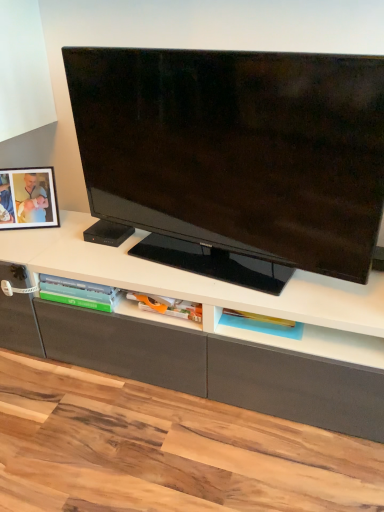
Identify the location of matte black tv at center. (233, 158).

Measure the distance between translucent plastic tray at lower center and camera.

They are 1.21 meters apart.

This screenshot has width=384, height=512. I want to click on matte black picture frame at left, so click(28, 198).

Considering the sizes of matte black picture frame at left and translucent plastic tray at lower center in the image, is matte black picture frame at left wider or thinner than translucent plastic tray at lower center?

matte black picture frame at left is thinner than translucent plastic tray at lower center.

Visually, is matte black picture frame at left positioned to the left or to the right of translucent plastic tray at lower center?

Based on their positions, matte black picture frame at left is located to the left of translucent plastic tray at lower center.

Can you tell me how much matte black picture frame at left and translucent plastic tray at lower center differ in facing direction?

The angle between the facing direction of matte black picture frame at left and the facing direction of translucent plastic tray at lower center is 24.3 degrees.

Does matte black picture frame at left come behind translucent plastic tray at lower center?

Yes.

Which object is positioned more to the right, translucent plastic tray at lower center or matte black tv at center?

Positioned to the right is translucent plastic tray at lower center.

Is translucent plastic tray at lower center taller or shorter than matte black tv at center?

In the image, translucent plastic tray at lower center appears to be shorter than matte black tv at center.

Considering the points (298, 336) and (142, 136), which point is behind, point (298, 336) or point (142, 136)?

Point (142, 136)

Which object is wider, translucent plastic tray at lower center or matte black tv at center?

translucent plastic tray at lower center.

From the image's perspective, which one is positioned higher, matte black tv at center or translucent plastic tray at lower center?

matte black tv at center appears higher in the image.

Is matte black tv at center in front of or behind translucent plastic tray at lower center in the image?

Visually, matte black tv at center is located in front of translucent plastic tray at lower center.

Is matte black tv at center placed right next to translucent plastic tray at lower center?

No, matte black tv at center is not beside translucent plastic tray at lower center.

Which is behind, point (142, 140) or point (250, 320)?

Positioned behind is point (250, 320).

Is matte black picture frame at left at the right side of matte black tv at center?

No.

How distant is matte black picture frame at left from matte black tv at center?

matte black picture frame at left and matte black tv at center are 56.54 centimeters apart from each other.

Is matte black tv at center completely or partially inside matte black picture frame at left?

Definitely not — matte black tv at center is not inside matte black picture frame at left.

From a real-world perspective, relative to matte black tv at center, is matte black picture frame at left vertically above or below?

matte black picture frame at left is situated lower than matte black tv at center in the real world.

Consider the image. What's the angular difference between matte black tv at center and matte black picture frame at left's facing directions?

There is a 34-degree angle between the facing directions of matte black tv at center and matte black picture frame at left.

Is matte black tv at center in front of or behind matte black picture frame at left in the image?

Visually, matte black tv at center is located in front of matte black picture frame at left.

Which of these two, matte black tv at center or matte black picture frame at left, is bigger?

matte black tv at center.

From a real-world perspective, is matte black tv at center physically located above or below matte black picture frame at left?

In terms of real-world spatial position, matte black tv at center is above matte black picture frame at left.

From a real-world perspective, is translucent plastic tray at lower center physically below matte black picture frame at left?

Yes.

Can you confirm if translucent plastic tray at lower center is shorter than matte black picture frame at left?

Correct, translucent plastic tray at lower center is not as tall as matte black picture frame at left.

Is point (267, 329) closer to camera compared to point (22, 196)?

Yes, it is.

Is matte black picture frame at left a part of translucent plastic tray at lower center?

No, matte black picture frame at left is not inside translucent plastic tray at lower center.

Image resolution: width=384 pixels, height=512 pixels. There is a translucent plastic tray at lower center. Find the location of `picture frame above it (from a real-world perspective)`. picture frame above it (from a real-world perspective) is located at coordinates [x=28, y=198].

Identify the location of shelf below the matte black tv at center (from the image's perspective). The image size is (384, 512). (262, 324).

Looking at the image, which one is located further to matte black picture frame at left, translucent plastic tray at lower center or matte black tv at center?

translucent plastic tray at lower center lies further to matte black picture frame at left than the other object.

When comparing their distances from translucent plastic tray at lower center, does matte black tv at center or matte black picture frame at left seem further?

matte black picture frame at left lies further to translucent plastic tray at lower center than the other object.

Considering their positions, is matte black picture frame at left positioned further to matte black tv at center than translucent plastic tray at lower center?

The object further to matte black tv at center is matte black picture frame at left.

Consider the image. Looking at the image, which one is located further to translucent plastic tray at lower center, matte black picture frame at left or matte black tv at center?

Among the two, matte black picture frame at left is located further to translucent plastic tray at lower center.

Based on their spatial positions, is translucent plastic tray at lower center or matte black picture frame at left further from matte black tv at center?

Based on the image, matte black picture frame at left appears to be further to matte black tv at center.

Based on the photo, estimate the real-world distances between objects in this image. Which object is further from matte black picture frame at left, matte black tv at center or translucent plastic tray at lower center?

translucent plastic tray at lower center lies further to matte black picture frame at left than the other object.

The height and width of the screenshot is (512, 384). Identify the location of television located between matte black picture frame at left and translucent plastic tray at lower center in the left-right direction. (233, 158).